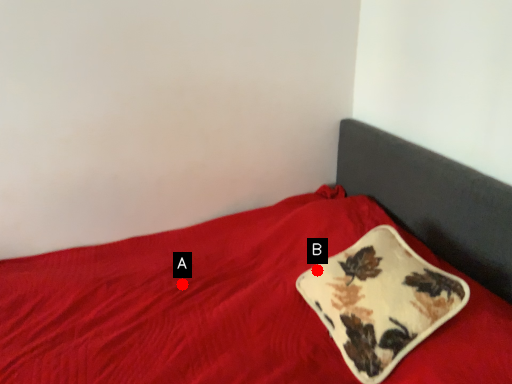
Question: Two points are circled on the image, labeled by A and B beside each circle. Which point is farther from the camera taking this photo?

Choices:
 (A) A is further
 (B) B is further

Answer: (A)